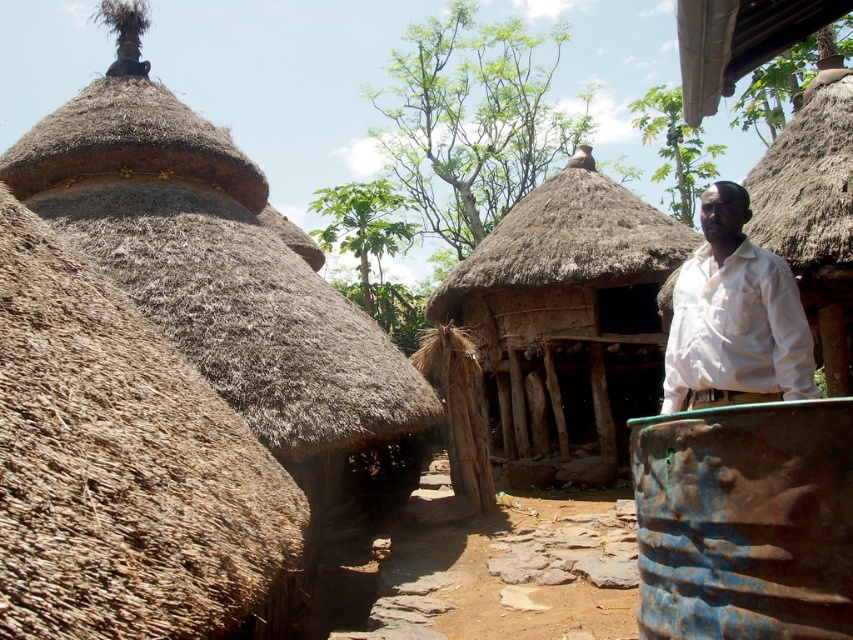
You are a delivery person standing at the thatched wood hut at center and need to deliver a package to the white cotton shirt at right. The delivery robot you are using has a maximum range of 30 feet. Can the robot successfully deliver the package?

The thatched wood hut at center and white cotton shirt at right are 30.16 feet apart from each other. Since the distance exceeds the robot maximum range of 30 feet, the robot cannot successfully deliver the package.

You are standing in front of the central hut and want to place a new item between the rusty metal barrel at right and the white cotton shirt at right. Which side should you place it on to ensure it is closer to the barrel?

You should place the new item to the left side between the rusty metal barrel at right and the white cotton shirt at right because the barrel is to the left of the shirt, so placing it closer to the barrel would mean positioning it on the barrel side of the space between them.